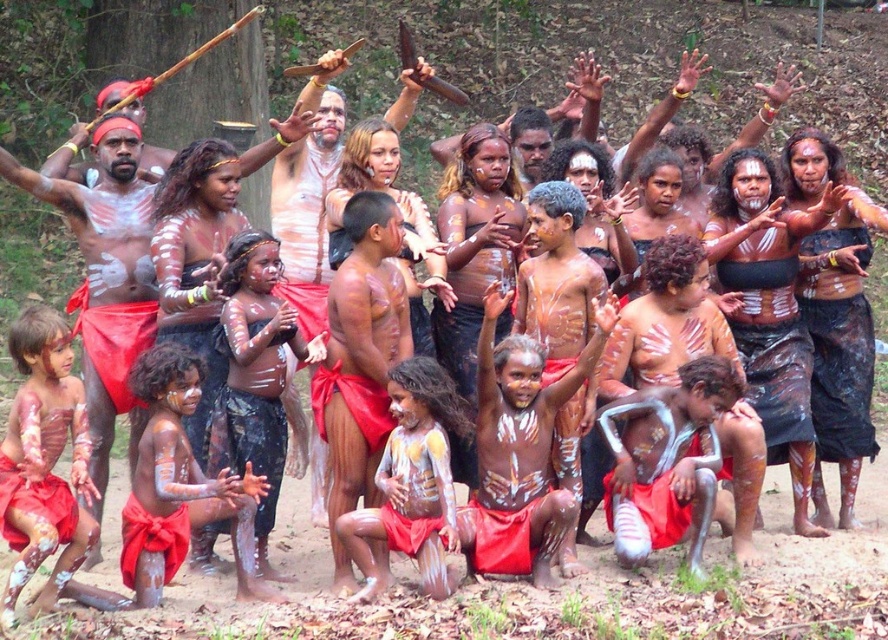
Which is behind, point (139, 301) or point (690, 452)?

The point (139, 301) is more distant.

Is matte red loincloth at left wider than white matte leg at lower center?

Indeed, matte red loincloth at left has a greater width compared to white matte leg at lower center.

Where is `matte red loincloth at left`? matte red loincloth at left is located at coordinates (106, 275).

Locate an element on the screen. matte red loincloth at left is located at coordinates (x=106, y=275).